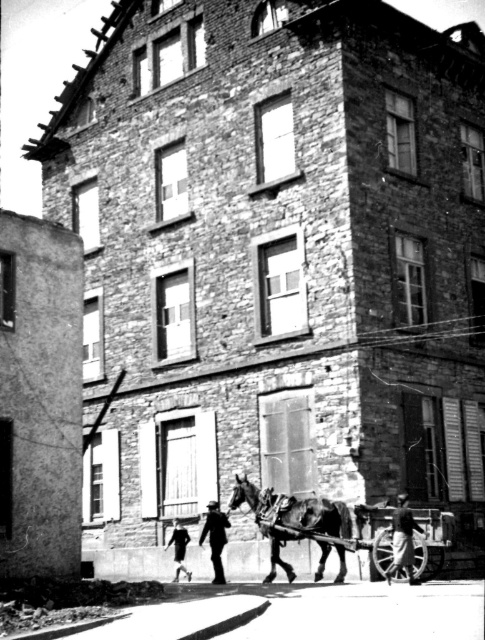
Question: Among these objects, which one is nearest to the camera?

Choices:
 (A) dark gray fabric coat at lower right
 (B) dark brown leather horse at lower center

Answer: (A)

Question: Which of the following is the farthest from the observer?

Choices:
 (A) (211, 525)
 (B) (258, 497)
 (C) (328, 541)
 (D) (186, 531)

Answer: (D)

Question: Does smooth wooden cart at lower center lie in front of dark gray fabric coat at lower center?

Choices:
 (A) no
 (B) yes

Answer: (B)

Question: Can you confirm if dark gray fabric coat at lower right is wider than dark gray fabric coat at lower center?

Choices:
 (A) no
 (B) yes

Answer: (B)

Question: Among these objects, which one is nearest to the camera?

Choices:
 (A) dark gray fabric coat at lower center
 (B) dark blue uniform at center

Answer: (B)

Question: Does dark brown leather horse at lower center have a lesser width compared to dark blue uniform at center?

Choices:
 (A) no
 (B) yes

Answer: (B)